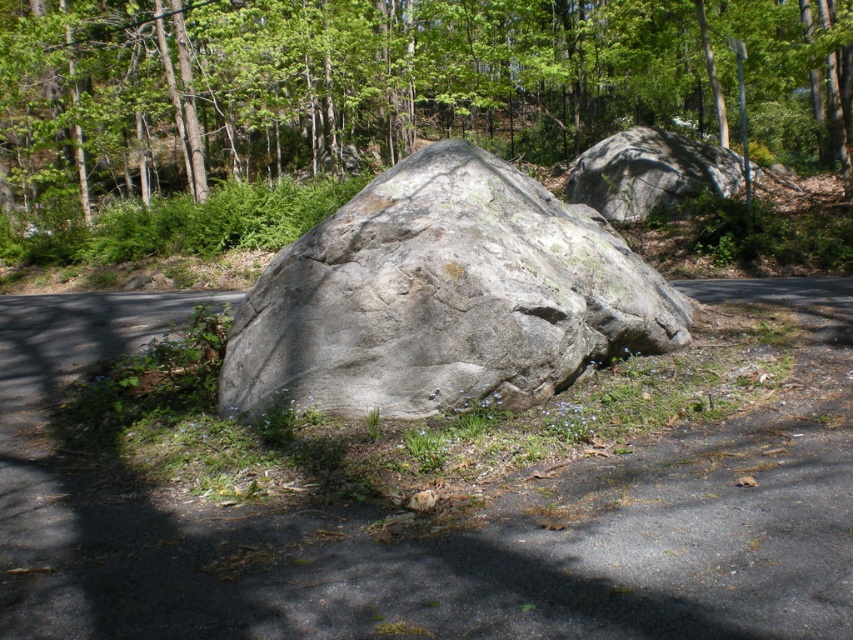
Between green leafy tree at center and gray rough boulder at upper right, which one appears on the right side from the viewer's perspective?

Positioned to the right is gray rough boulder at upper right.

Can you confirm if green leafy tree at center is smaller than gray rough boulder at upper right?

Incorrect, green leafy tree at center is not smaller in size than gray rough boulder at upper right.

Describe the element at coordinates (393, 84) in the screenshot. I see `green leafy tree at center` at that location.

Image resolution: width=853 pixels, height=640 pixels. Identify the location of green leafy tree at center. (393, 84).

Which is more to the left, gray rough rock at center or gray rough boulder at upper right?

Positioned to the left is gray rough rock at center.

Which of these two, gray rough rock at center or gray rough boulder at upper right, stands taller?

Standing taller between the two is gray rough boulder at upper right.

This screenshot has width=853, height=640. What do you see at coordinates (444, 298) in the screenshot?
I see `gray rough rock at center` at bounding box center [444, 298].

Where is `gray rough rock at center`? gray rough rock at center is located at coordinates (444, 298).

The width and height of the screenshot is (853, 640). In order to click on green leafy tree at center in this screenshot , I will do `click(393, 84)`.

Does green leafy tree at center have a smaller size compared to gray rough rock at center?

No.

Find the location of a particular element. The width and height of the screenshot is (853, 640). green leafy tree at center is located at coordinates (393, 84).